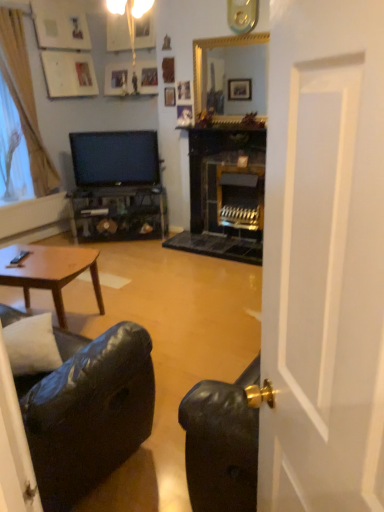
Question: Is wooden picture frame at upper center bigger than black leather couch at lower left?

Choices:
 (A) no
 (B) yes

Answer: (A)

Question: From the image's perspective, is wooden picture frame at upper center under black leather couch at lower left?

Choices:
 (A) yes
 (B) no

Answer: (B)

Question: Is black leather couch at lower left completely or partially inside wooden picture frame at upper center?

Choices:
 (A) no
 (B) yes

Answer: (A)

Question: Is wooden picture frame at upper center facing towards black leather couch at lower left?

Choices:
 (A) yes
 (B) no

Answer: (A)

Question: From a real-world perspective, is wooden picture frame at upper center beneath black leather couch at lower left?

Choices:
 (A) no
 (B) yes

Answer: (A)

Question: Is wooden picture frame at upper center turned away from black leather couch at lower left?

Choices:
 (A) yes
 (B) no

Answer: (B)

Question: Could you tell me if transparent plastic window screen at left is turned towards white soft pillow at lower left?

Choices:
 (A) no
 (B) yes

Answer: (A)

Question: Can we say transparent plastic window screen at left lies outside white soft pillow at lower left?

Choices:
 (A) no
 (B) yes

Answer: (B)

Question: Is transparent plastic window screen at left placed right next to white soft pillow at lower left?

Choices:
 (A) no
 (B) yes

Answer: (A)

Question: Considering the relative sizes of transparent plastic window screen at left and white soft pillow at lower left in the image provided, is transparent plastic window screen at left wider than white soft pillow at lower left?

Choices:
 (A) no
 (B) yes

Answer: (A)

Question: Is transparent plastic window screen at left smaller than white soft pillow at lower left?

Choices:
 (A) yes
 (B) no

Answer: (B)

Question: Does transparent plastic window screen at left have a lesser height compared to white soft pillow at lower left?

Choices:
 (A) no
 (B) yes

Answer: (A)

Question: Considering the relative sizes of black leather couch at lower left and gold-framed mirror at upper center in the image provided, is black leather couch at lower left shorter than gold-framed mirror at upper center?

Choices:
 (A) yes
 (B) no

Answer: (B)